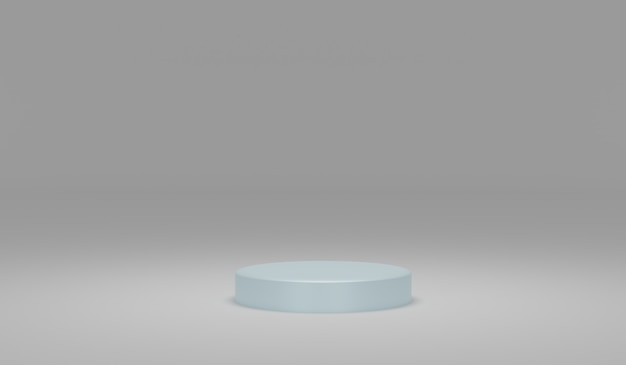
At what (x,y) coordinates should I click in order to perform the action: click on slight shadowing underneath object. Please return your answer as a coordinate pair (x, y). Looking at the image, I should click on (411, 306).